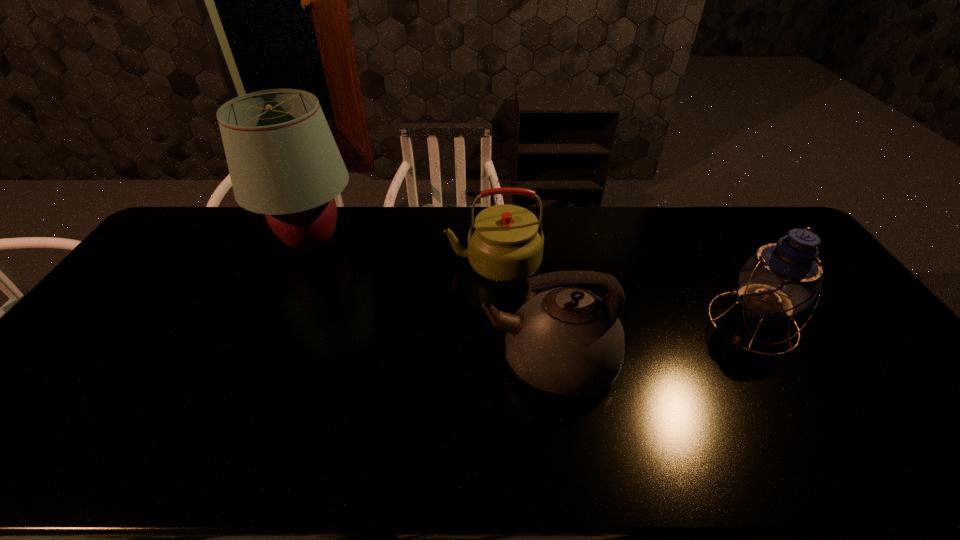
Where is `free space between the nearer kettle and the lantern`? The image size is (960, 540). free space between the nearer kettle and the lantern is located at coordinates (651, 342).

This screenshot has width=960, height=540. Find the location of `free space that is in between the rightmost object and the nearer kettle`. free space that is in between the rightmost object and the nearer kettle is located at coordinates (651, 342).

You are a GUI agent. You are given a task and a screenshot of the screen. Output one action in this format:
    pyautogui.click(x=<x>, y=<y>)
    Task: Click on the vacant area that lies between the nearer kettle and the rightmost object
    
    Given the screenshot: What is the action you would take?
    pyautogui.click(x=651, y=342)

Where is `blank region between the shears and the lampshade`? blank region between the shears and the lampshade is located at coordinates (246, 327).

Find the location of `blank region between the nearer kettle and the lampshade`. blank region between the nearer kettle and the lampshade is located at coordinates (431, 302).

I want to click on vacant point located between the shears and the lampshade, so click(x=246, y=327).

At what (x,y) coordinates should I click in order to perform the action: click on free spot between the farther kettle and the shears. Please return your answer as a coordinate pair (x, y). Image resolution: width=960 pixels, height=540 pixels. Looking at the image, I should click on (337, 336).

The image size is (960, 540). I want to click on vacant area between the shortest object and the nearer kettle, so click(x=365, y=387).

The height and width of the screenshot is (540, 960). What are the coordinates of `vacant region between the rightmost object and the nearer kettle` in the screenshot? It's located at (651, 342).

Image resolution: width=960 pixels, height=540 pixels. I want to click on object that ranks as the fourth closest to the tallest object, so click(782, 279).